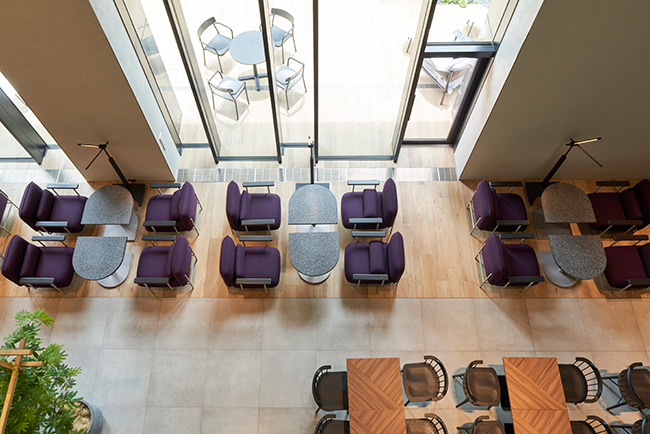
Locate an element on the screen. Image resolution: width=650 pixels, height=434 pixels. tables is located at coordinates (382, 399), (547, 400), (582, 248), (566, 197), (326, 253), (317, 202), (95, 244), (107, 208), (248, 56).